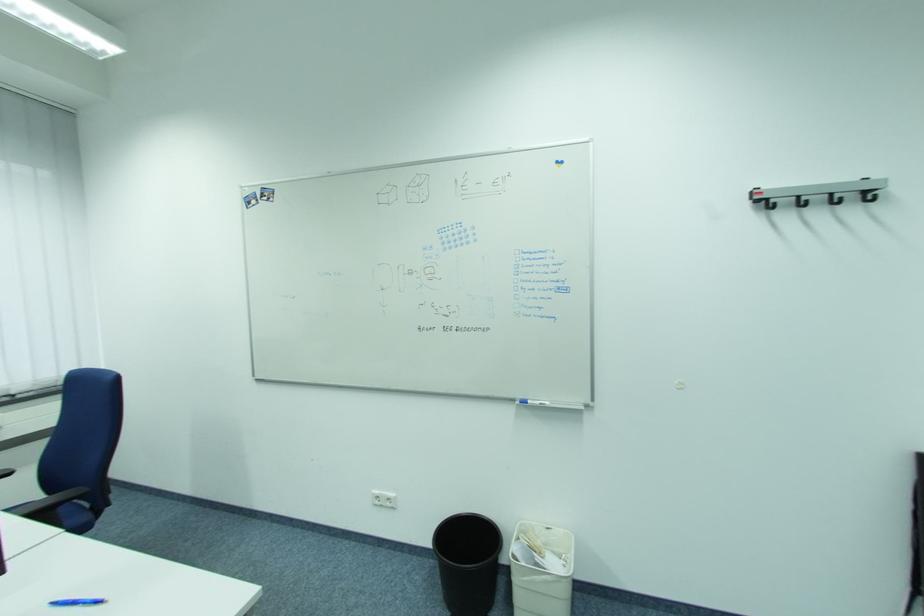
Where is `white trash can`? white trash can is located at coordinates (541, 570).